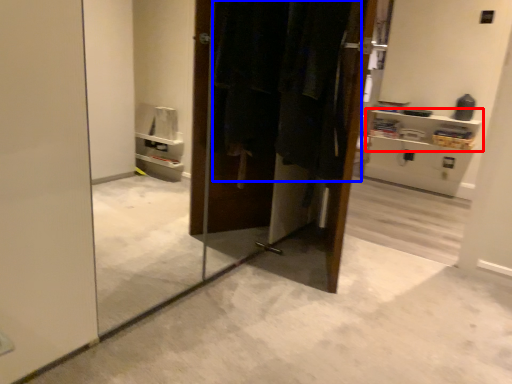
Question: Which point is further to the camera, shelf (highlighted by a red box) or laundry (highlighted by a blue box)?

Choices:
 (A) shelf
 (B) laundry

Answer: (A)